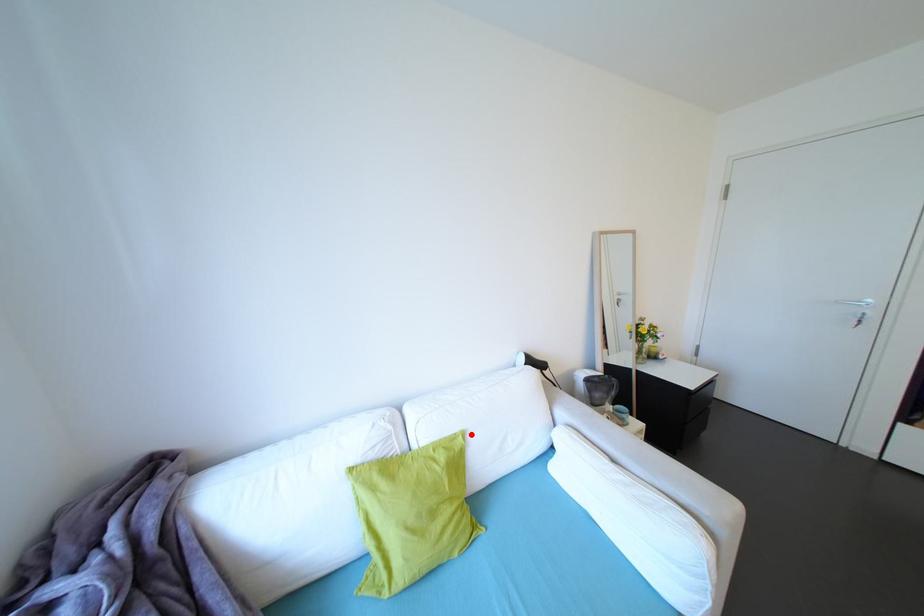
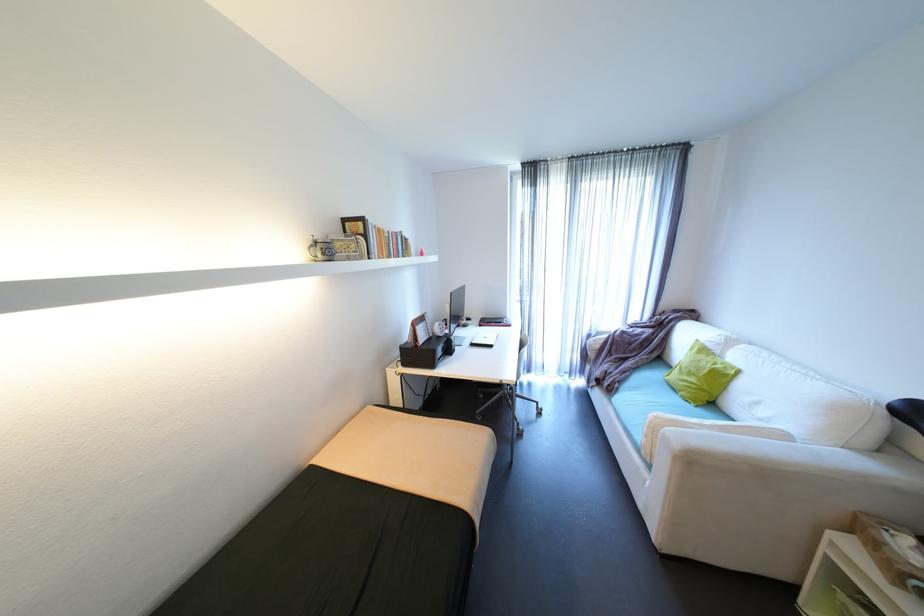
Find the pixel in the second image that matches the highlighted location in the first image.

(747, 371)